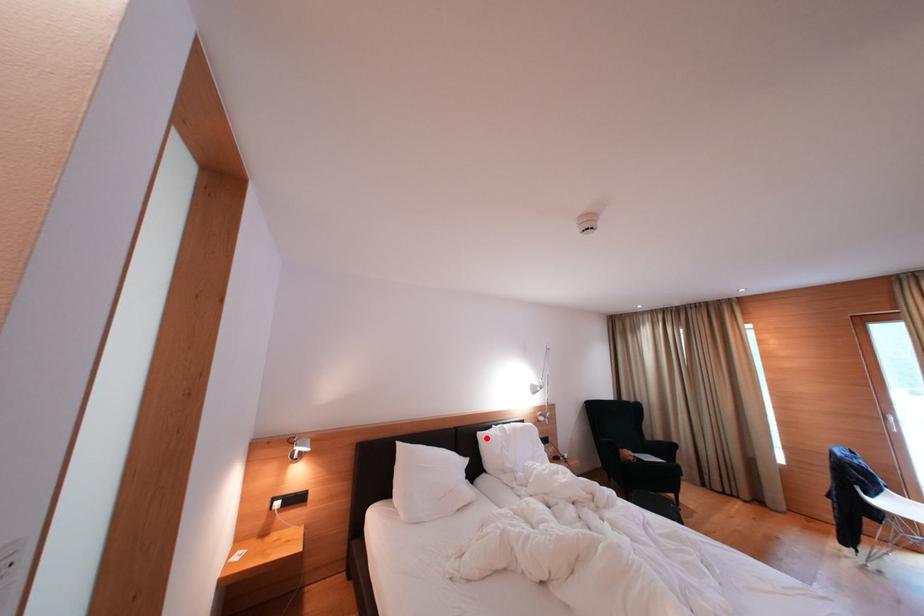
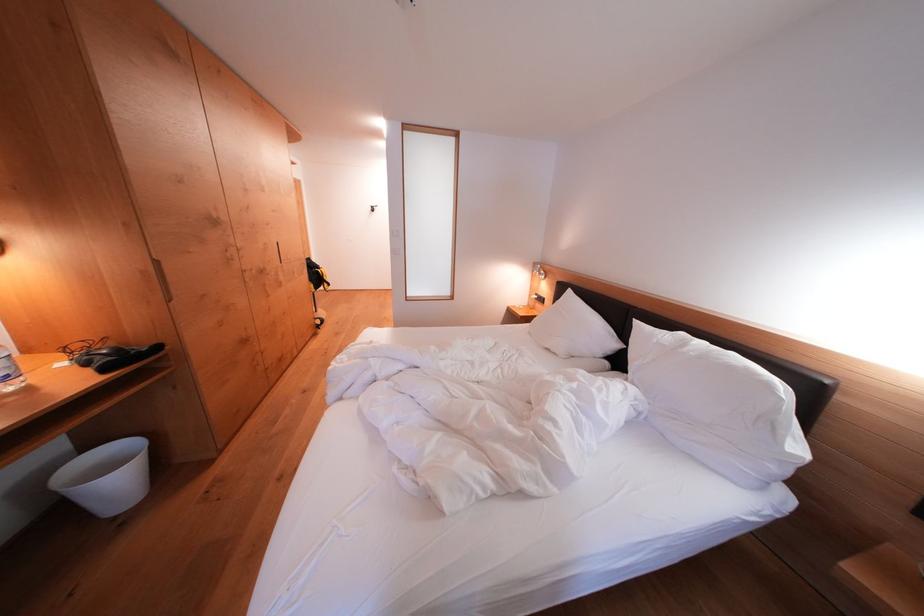
The point at the highlighted location is marked in the first image. Where is the corresponding point in the second image?

(642, 326)